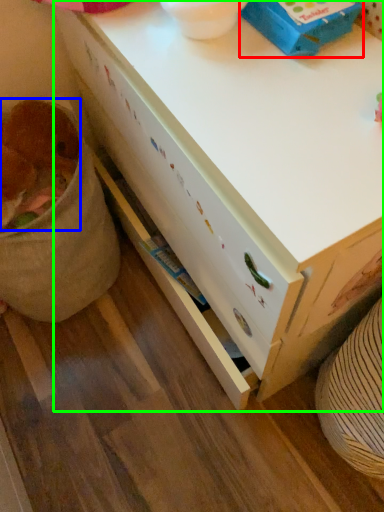
Question: Which object is the farthest from box (highlighted by a red box)? Choose among these: animal (highlighted by a blue box) or desk (highlighted by a green box).

Choices:
 (A) animal
 (B) desk

Answer: (A)